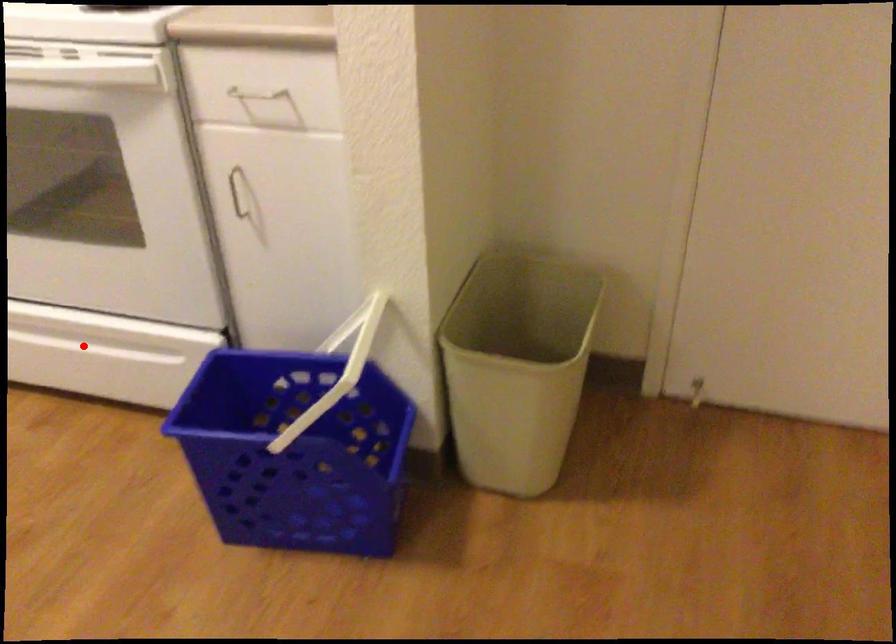
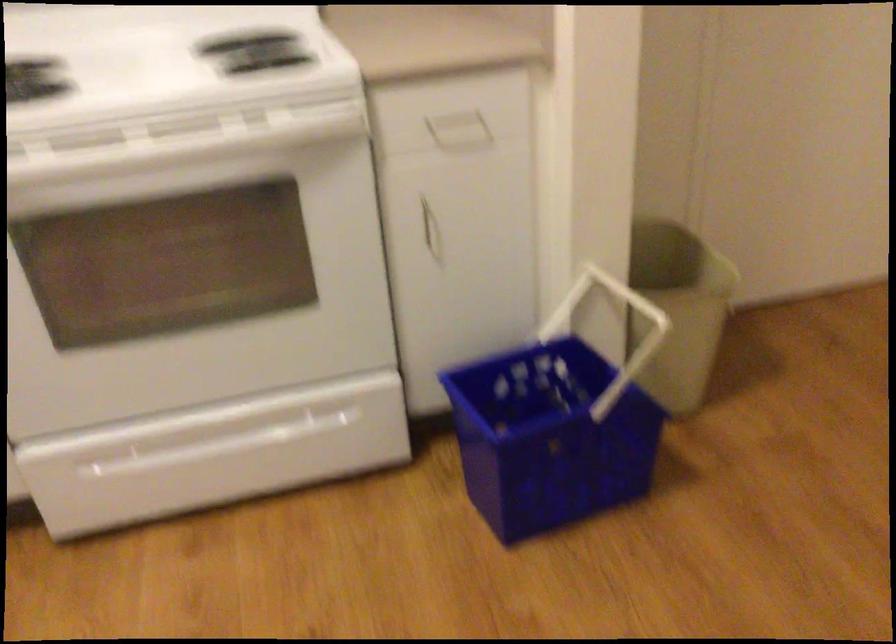
Where in the second image is the point corresponding to the highlighted location from the first image?

(233, 440)